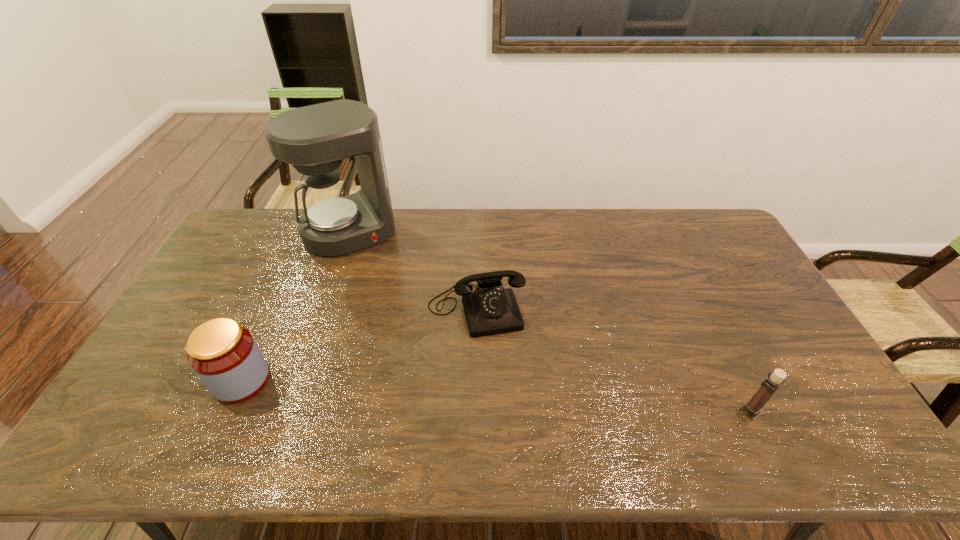
The height and width of the screenshot is (540, 960). What are the coordinates of `blank space at the far left corner of the desktop` in the screenshot? It's located at coord(255,226).

Locate an element on the screen. Image resolution: width=960 pixels, height=540 pixels. free space at the far right corner is located at coordinates (698, 223).

Where is `vacant space at the near right corner`? The height and width of the screenshot is (540, 960). vacant space at the near right corner is located at coordinates (807, 402).

Image resolution: width=960 pixels, height=540 pixels. I want to click on free space between the rightmost object and the shortest object, so click(613, 360).

I want to click on vacant point located between the telephone and the farthest object, so click(414, 271).

Find the location of a particular element. The width and height of the screenshot is (960, 540). vacant area that lies between the tallest object and the candle holder is located at coordinates point(551,321).

Identify the location of vacant space that is in between the candle holder and the farthest object. (551, 321).

Identify the location of free spot between the jar and the tallest object. The width and height of the screenshot is (960, 540). (297, 306).

This screenshot has height=540, width=960. I want to click on empty space that is in between the telephone and the candle holder, so click(613, 360).

Locate an element on the screen. free space between the jar and the coffee maker is located at coordinates (297, 306).